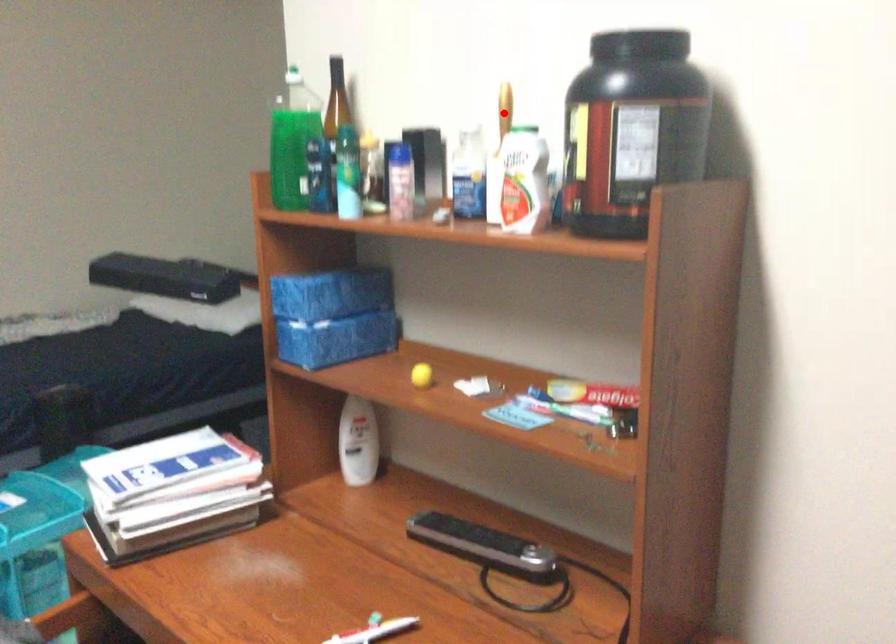
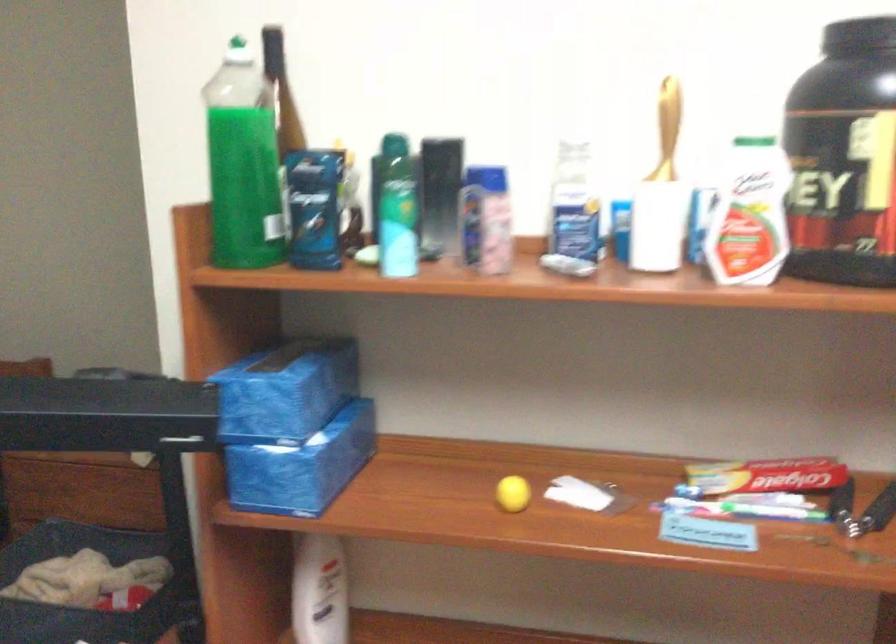
Question: I am providing you with two images of the same scene from different viewpoints. Image1 has a red point marked. In image2, the corresponding 3D location appears at what relative position? Reply with the corresponding letter.

Choices:
 (A) Closer
 (B) Farther

Answer: (A)